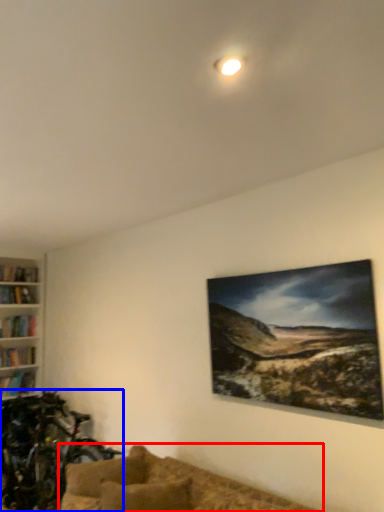
Question: Among these objects, which one is nearest to the camera, studio couch (highlighted by a red box) or mountain bike (highlighted by a blue box)?

Choices:
 (A) studio couch
 (B) mountain bike

Answer: (A)